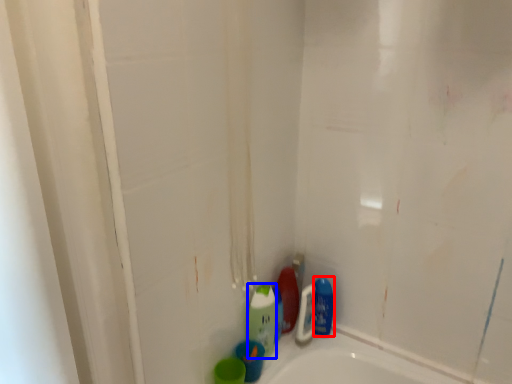
Question: Which point is closer to the camera, mouthwash (highlighted by a red box) or cleaning product (highlighted by a blue box)?

Choices:
 (A) mouthwash
 (B) cleaning product

Answer: (B)